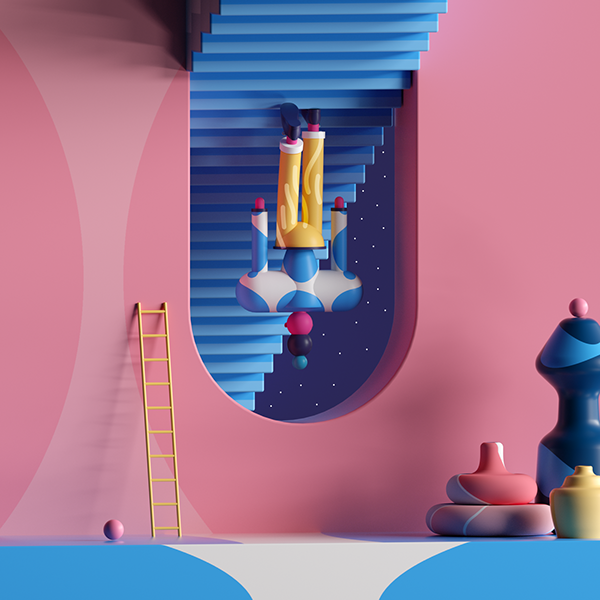
The image size is (600, 600). Find the location of `upside down staircase`. upside down staircase is located at coordinates (351, 102).